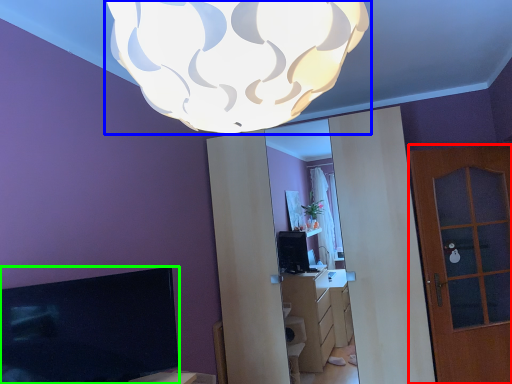
Question: Based on their relative distances, which object is farther from door (highlighted by a red box)? Choose from lamp (highlighted by a blue box) and television (highlighted by a green box).

Choices:
 (A) lamp
 (B) television

Answer: (A)